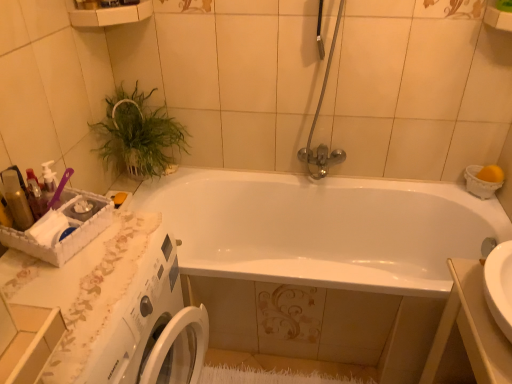
Locate an element on the screen. The image size is (512, 384). vacant point above white lace counter top at lower left (from a real-world perspective) is located at coordinates (91, 272).